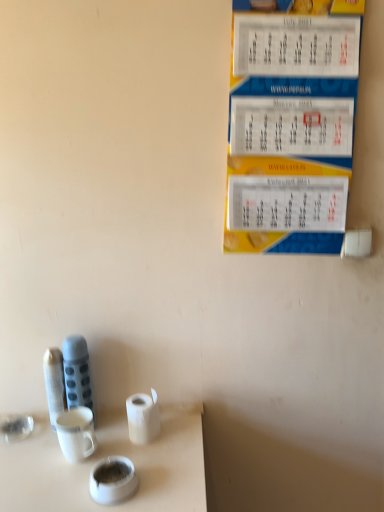
Question: From a real-world perspective, is white matte toilet paper at lower center beneath matte gray thermos at left?

Choices:
 (A) no
 (B) yes

Answer: (B)

Question: Can matte gray thermos at left be found inside white matte toilet paper at lower center?

Choices:
 (A) no
 (B) yes

Answer: (A)

Question: Is white matte toilet paper at lower center oriented away from matte gray thermos at left?

Choices:
 (A) no
 (B) yes

Answer: (A)

Question: Is white matte toilet paper at lower center thinner than matte gray thermos at left?

Choices:
 (A) no
 (B) yes

Answer: (A)

Question: Can you confirm if white matte toilet paper at lower center is taller than matte gray thermos at left?

Choices:
 (A) yes
 (B) no

Answer: (B)

Question: In the image, is matte gray thermos at left on the left side or the right side of white matte toilet paper at lower center?

Choices:
 (A) left
 (B) right

Answer: (A)

Question: Is matte gray thermos at left in front of or behind white matte toilet paper at lower center in the image?

Choices:
 (A) behind
 (B) front

Answer: (A)

Question: Does point (72, 346) appear closer or farther from the camera than point (130, 403)?

Choices:
 (A) farther
 (B) closer

Answer: (B)

Question: In terms of size, does matte gray thermos at left appear bigger or smaller than white matte toilet paper at lower center?

Choices:
 (A) big
 (B) small

Answer: (A)

Question: From a real-world perspective, is white matte toilet paper at lower center positioned above or below white glossy teacup at lower center?

Choices:
 (A) above
 (B) below

Answer: (A)

Question: Would you say white matte toilet paper at lower center is to the left or to the right of white glossy teacup at lower center in the picture?

Choices:
 (A) left
 (B) right

Answer: (B)

Question: In terms of width, does white matte toilet paper at lower center look wider or thinner when compared to white glossy teacup at lower center?

Choices:
 (A) wide
 (B) thin

Answer: (B)

Question: Considering the positions of white matte toilet paper at lower center and white glossy teacup at lower center in the image, is white matte toilet paper at lower center taller or shorter than white glossy teacup at lower center?

Choices:
 (A) short
 (B) tall

Answer: (B)

Question: Considering their positions, is white glossy teacup at lower center located in front of or behind matte gray thermos at left?

Choices:
 (A) behind
 (B) front

Answer: (B)

Question: From their relative heights in the image, would you say white glossy teacup at lower center is taller or shorter than matte gray thermos at left?

Choices:
 (A) tall
 (B) short

Answer: (B)